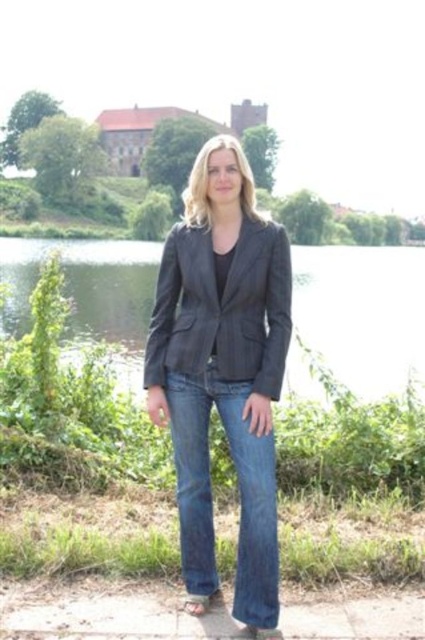
You are a photographer planning to capture a wide shot of the scene. Considering the transparent water at center and the dark gray pinstripe blazer at center, which object occupies more horizontal space in the image?

The transparent water at center occupies more horizontal space in the image because its width is larger than that of the dark gray pinstripe blazer at center.

You are a hiker who wants to cross the transparent water at center to reach the historic building on the hill. Your sandal, brown leather sandal at lower center, is 10 cm wide. Can you safely step across the water if the water is 12 cm wide?

The transparent water at center might be wider than brown leather sandal at lower center. Since the sandal is 10 cm wide and the water is 12 cm wide, you can safely step across the water as the width of the water is greater than the sandal.

You are a photographer trying to capture the person in the dark gray pinstripe blazer at center. Since the transparent water at center is in the way, can you adjust your camera angle to focus on the blazer without the water obstructing the view?

The transparent water at center is further to the viewer than the dark gray pinstripe blazer at center, so adjusting the camera angle to focus on the blazer behind the water might be possible since the water is closer and transparent.